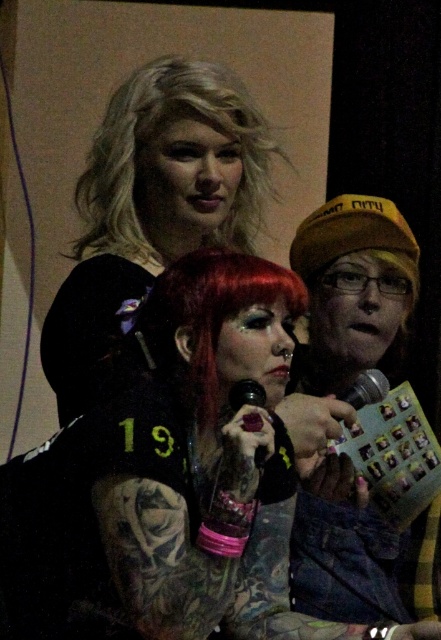
Looking at this image, who is taller, metallic silver microphone at center or translucent plastic microphone at center?

With more height is translucent plastic microphone at center.

Does metallic silver microphone at center appear on the right side of translucent plastic microphone at center?

Correct, you'll find metallic silver microphone at center to the right of translucent plastic microphone at center.

Between point (388, 388) and point (257, 449), which one is positioned behind?

Point (388, 388)

What are the coordinates of `metallic silver microphone at center` in the screenshot? It's located at tap(366, 388).

Is black matte cap at right positioned in front of blondehair at upper center?

Yes.

Identify the location of black matte cap at right. (x=348, y=305).

Between point (328, 392) and point (118, 196), which one is positioned behind?

The point (328, 392) is behind.

Locate an element on the screen. black matte cap at right is located at coordinates (348, 305).

Is black matte cap at right positioned behind shiny red hair at center?

Yes, it is.

Measure the distance between point [399,538] and camera.

5.74 feet

Image resolution: width=441 pixels, height=640 pixels. What do you see at coordinates (348, 305) in the screenshot?
I see `black matte cap at right` at bounding box center [348, 305].

Locate an element on the screen. black matte cap at right is located at coordinates (348, 305).